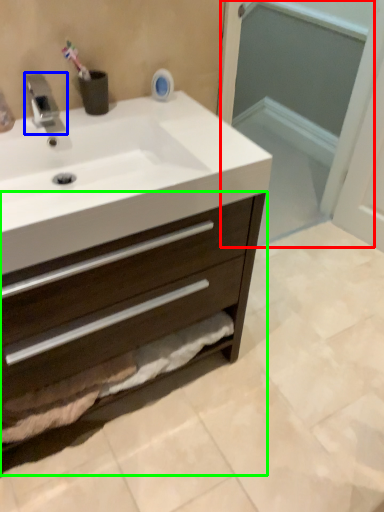
Question: Which object is the closest to the screen door (highlighted by a red box)? Choose among these: tap (highlighted by a blue box) or bathroom cabinet (highlighted by a green box).

Choices:
 (A) tap
 (B) bathroom cabinet

Answer: (B)